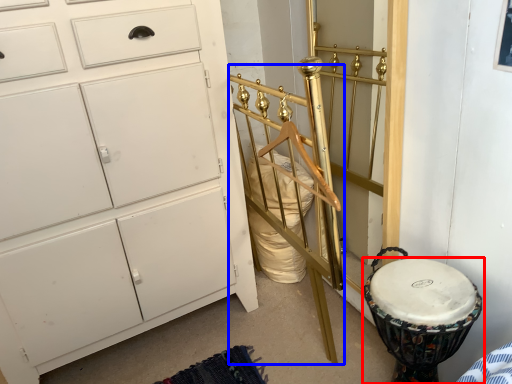
Question: Among these objects, which one is farthest to the camera, drum (highlighted by a red box) or bed frame (highlighted by a blue box)?

Choices:
 (A) drum
 (B) bed frame

Answer: (A)